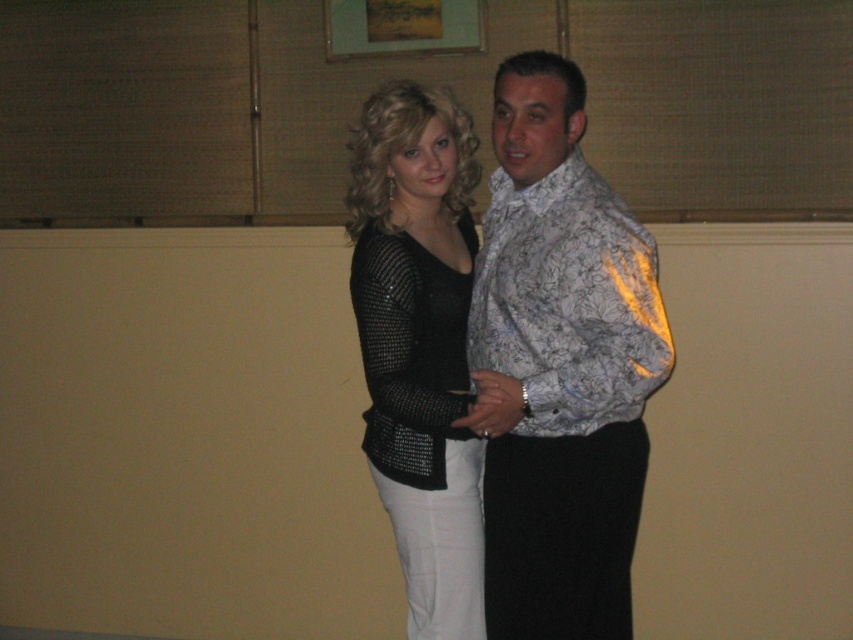
Question: Is shiny silver shirt at center positioned at the back of black sequined top at center?

Choices:
 (A) yes
 (B) no

Answer: (B)

Question: Which object is the closest to the black sequined dress at center?

Choices:
 (A) shiny silver shirt at center
 (B) black sequined top at center

Answer: (B)

Question: Is shiny silver shirt at center positioned in front of black sequined dress at center?

Choices:
 (A) no
 (B) yes

Answer: (B)

Question: Among these objects, which one is nearest to the camera?

Choices:
 (A) black sequined top at center
 (B) shiny silver shirt at center

Answer: (B)

Question: Which point appears farthest from the camera in this image?

Choices:
 (A) (351, 291)
 (B) (456, 109)

Answer: (B)

Question: Can you confirm if black sequined top at center is positioned to the left of black sequined dress at center?

Choices:
 (A) yes
 (B) no

Answer: (B)